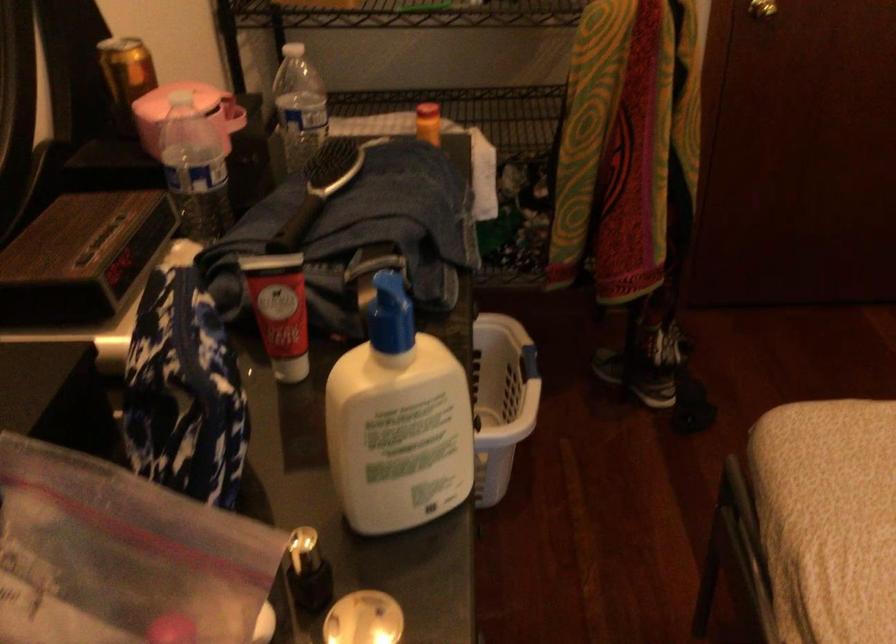
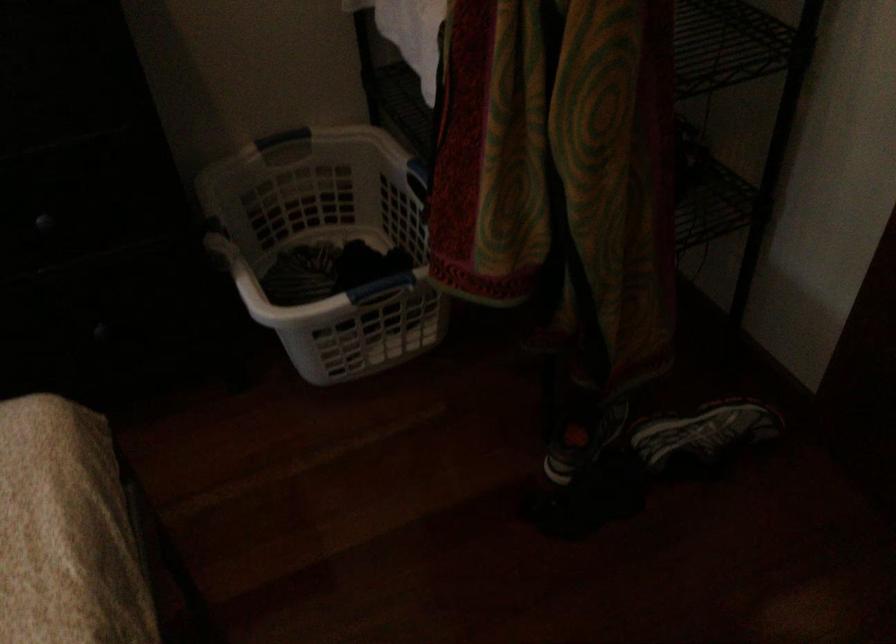
Find the pixel in the second image that matches the point at 686,326 in the first image.

(702, 436)